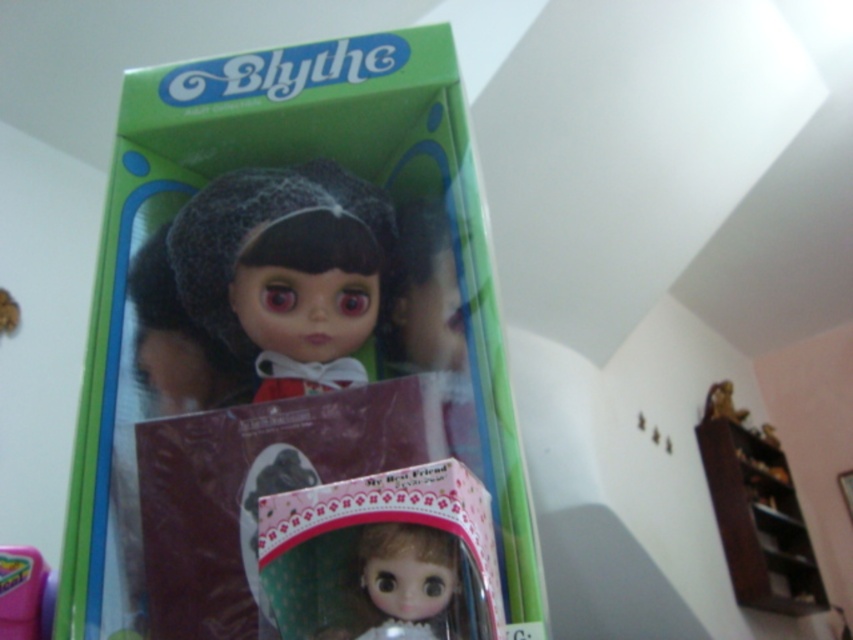
Which is behind, point (361, 198) or point (399, 534)?

The point (361, 198) is more distant.

At what (x,y) coordinates should I click in order to perform the action: click on satin black doll at center. Please return your answer as a coordinate pair (x, y). This screenshot has width=853, height=640. Looking at the image, I should click on coord(285,272).

At what (x,y) coordinates should I click in order to perform the action: click on satin black doll at center. Please return your answer as a coordinate pair (x, y). This screenshot has width=853, height=640. Looking at the image, I should click on pyautogui.click(x=285, y=272).

Consider the image. Which is above, green plastic box at center or matte plastic toy at lower left?

green plastic box at center is higher up.

Does point (285, 150) come in front of point (51, 605)?

No, it is not.

Between point (442, 259) and point (33, 621), which one is positioned in front?

Point (33, 621)

Find the location of a particular element. This screenshot has height=640, width=853. green plastic box at center is located at coordinates (287, 342).

Is green plastic box at center smaller than satin black doll at center?

Actually, green plastic box at center might be larger than satin black doll at center.

Between point (428, 580) and point (256, 340), which one is positioned in front?

Point (428, 580) is more forward.

Where is `green plastic box at center`? green plastic box at center is located at coordinates (287, 342).